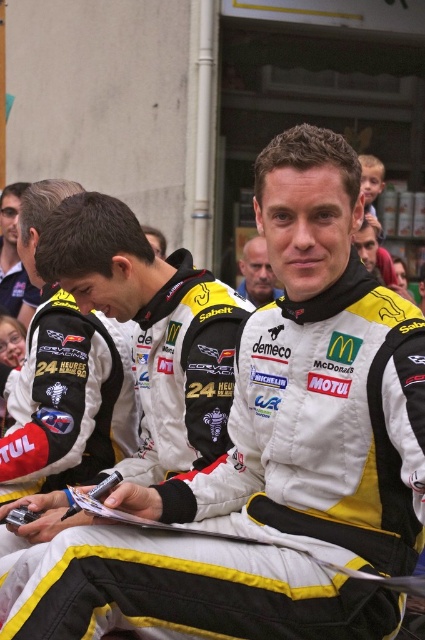
Question: Which of the following is the closest to the observer?

Choices:
 (A) white leather jacket at center
 (B) matte black helmet at upper left

Answer: (A)

Question: Is matte black helmet at upper left to the right of white leather jacket at center from the viewer's perspective?

Choices:
 (A) no
 (B) yes

Answer: (A)

Question: Among these objects, which one is nearest to the camera?

Choices:
 (A) white leather jacket at center
 (B) matte black helmet at upper left

Answer: (A)

Question: Considering the relative positions of matte black helmet at upper left and white leather jacket at center in the image provided, where is matte black helmet at upper left located with respect to white leather jacket at center?

Choices:
 (A) above
 (B) below

Answer: (A)

Question: Does matte black helmet at upper left have a lesser width compared to white leather jacket at center?

Choices:
 (A) no
 (B) yes

Answer: (A)